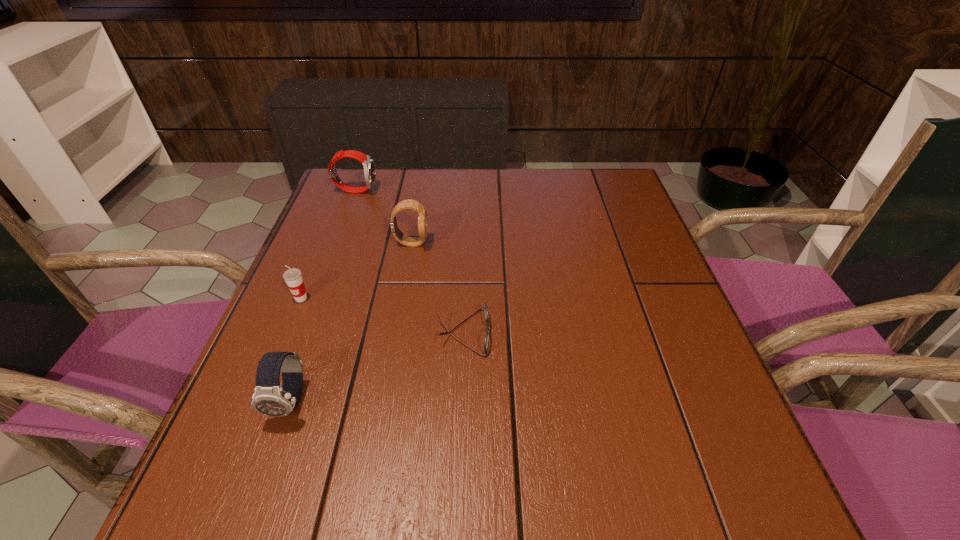
Identify the location of free location located on the face of the nearest object. This screenshot has height=540, width=960. (252, 510).

In order to click on vacant point located on the side of the cup with the logo in this screenshot , I will do `click(248, 427)`.

Where is `free space located on the front-facing side of the shortest object`? free space located on the front-facing side of the shortest object is located at coordinates (672, 332).

Where is `object at the far edge`? object at the far edge is located at coordinates (368, 164).

Where is `cup located at the left edge`? The width and height of the screenshot is (960, 540). cup located at the left edge is located at coordinates (293, 278).

Identify the location of object present at the far left corner. (368, 164).

Image resolution: width=960 pixels, height=540 pixels. In the image, there is a desktop. Identify the location of blank space at the far edge. (479, 178).

At what (x,y) coordinates should I click in order to perform the action: click on free space at the near edge of the desktop. Please return your answer as a coordinate pair (x, y). The image size is (960, 540). Looking at the image, I should click on (368, 480).

The image size is (960, 540). In order to click on free region at the left edge in this screenshot , I will do tap(335, 272).

The image size is (960, 540). I want to click on free spot at the right edge of the desktop, so click(640, 248).